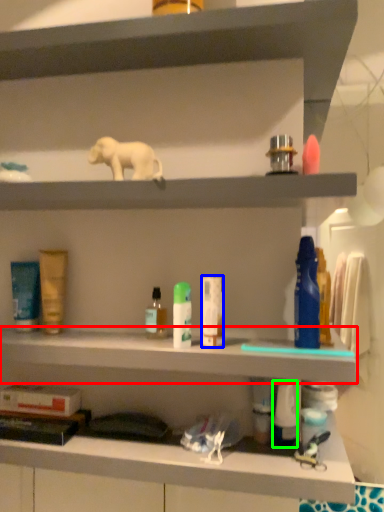
Question: Which object is positioned farthest from cabinet (highlighted by a red box)? Select from toiletry (highlighted by a blue box) and toiletry (highlighted by a green box).

Choices:
 (A) toiletry
 (B) toiletry

Answer: (B)